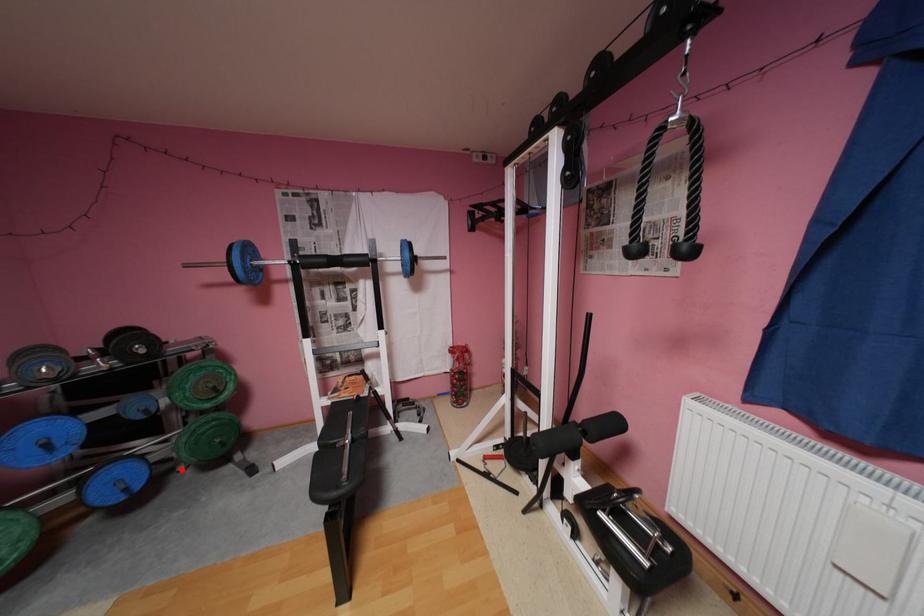
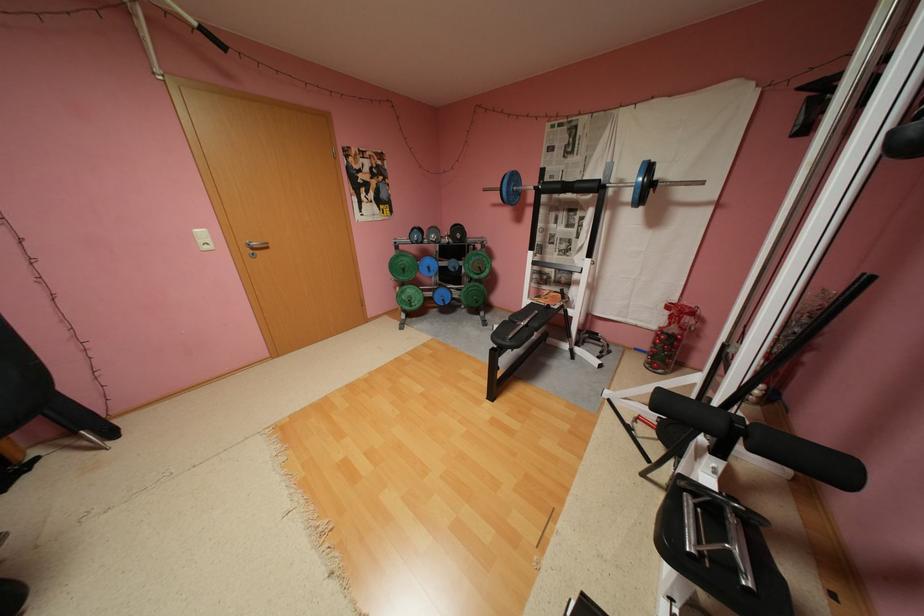
Question: A red point is marked in image1. In image2, is the corresponding 3D point closer to the camera or farther? Reply with the corresponding letter.

Choices:
 (A) The corresponding 3D point is closer.
 (B) The corresponding 3D point is farther.

Answer: (A)